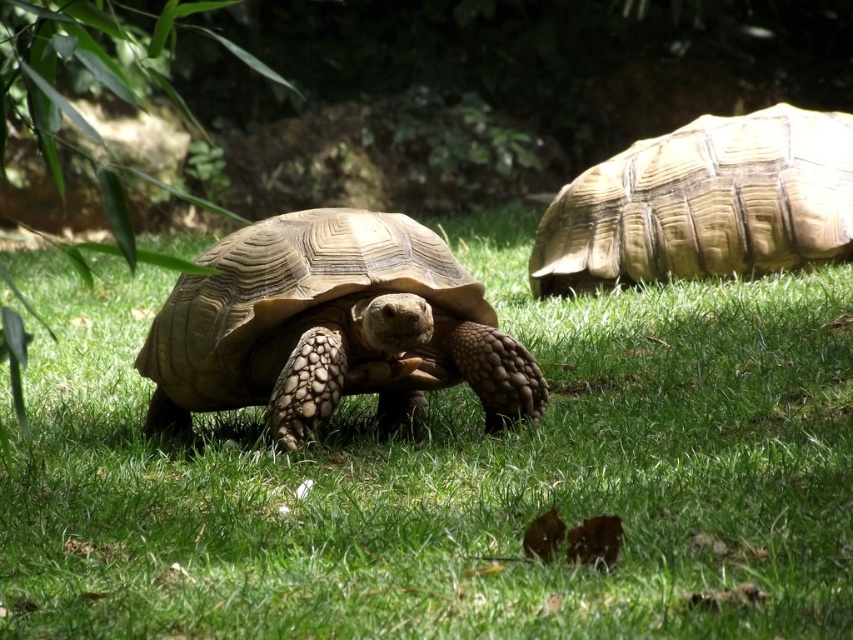
What is the 2D coordinate of the green grass at center?

The 2D coordinate of the green grass at center is at point (451, 476).